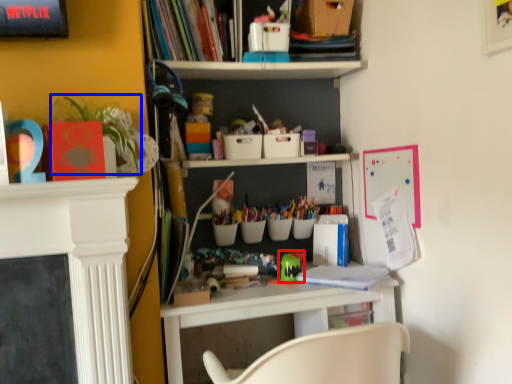
Question: Which object is further to the camera taking this photo, toy (highlighted by a red box) or plant (highlighted by a blue box)?

Choices:
 (A) toy
 (B) plant

Answer: (A)